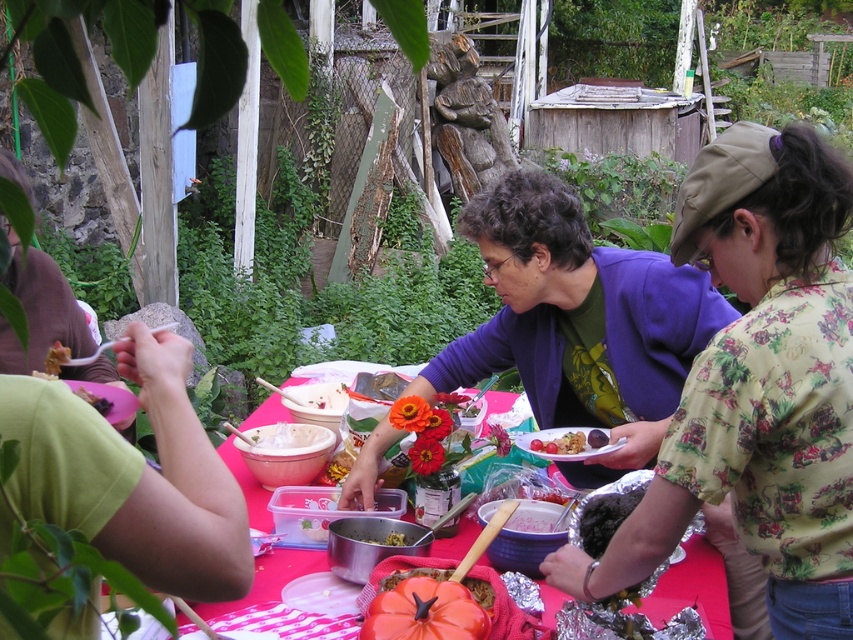
Question: Which object appears farthest from the camera in this image?

Choices:
 (A) shiny metallic bowl at center
 (B) golden brown crumbly at center

Answer: (B)

Question: Which object is positioned farthest from the orange matte pumpkin at center?

Choices:
 (A) shiny metallic bowl at center
 (B) matte brown bread at lower left

Answer: (B)

Question: Which point appears closest to the camera in this image?

Choices:
 (A) (473, 580)
 (B) (418, 584)

Answer: (B)

Question: Does floral cotton shirt at center have a larger size compared to matte plastic bowl at center?

Choices:
 (A) yes
 (B) no

Answer: (A)

Question: Does matte plastic bowl at center appear on the left side of matte brown bread at lower left?

Choices:
 (A) no
 (B) yes

Answer: (A)

Question: Is golden brown crumbly at center behind matte brown bread at lower left?

Choices:
 (A) yes
 (B) no

Answer: (A)